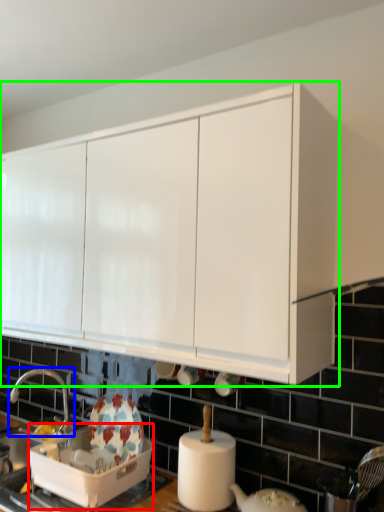
Question: Estimate the real-world distances between objects in this image. Which object is closer to appliance (highlighted by a red box), tap (highlighted by a blue box) or cabinetry (highlighted by a green box)?

Choices:
 (A) tap
 (B) cabinetry

Answer: (A)